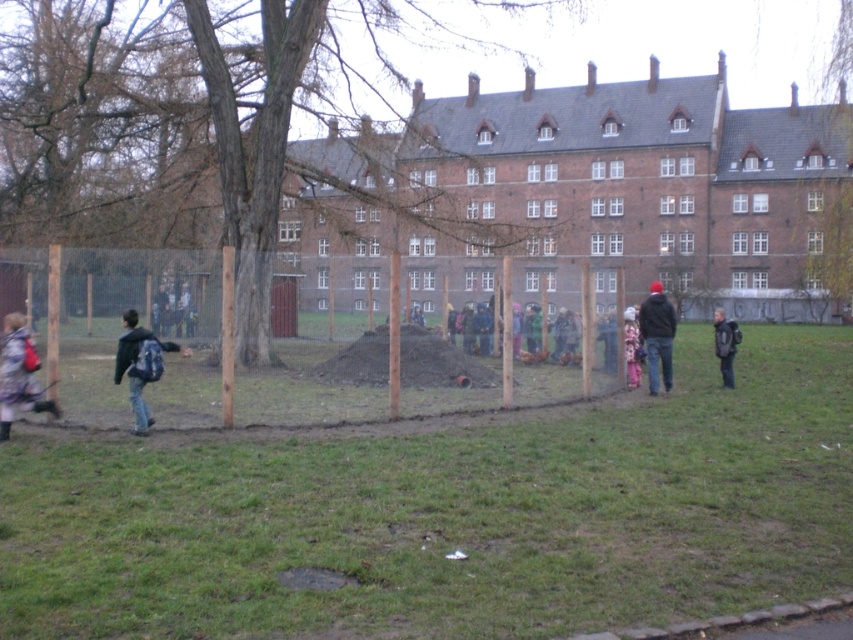
Question: Among these objects, which one is nearest to the camera?

Choices:
 (A) dark gray backpack at right
 (B) matte pink backpack at lower left
 (C) matte black backpack at left
 (D) brown wooden fence at center

Answer: (D)

Question: Can you confirm if matte black backpack at left is smaller than dark gray backpack at right?

Choices:
 (A) yes
 (B) no

Answer: (A)

Question: Which point is closer to the camera taking this photo?

Choices:
 (A) (732, 376)
 (B) (131, 333)
 (C) (20, 372)
 (D) (94, 602)

Answer: (D)

Question: Can you confirm if dark blue jacket at center is positioned above dark gray backpack at right?

Choices:
 (A) no
 (B) yes

Answer: (B)

Question: Can you confirm if brown wooden fence at center is positioned to the right of matte pink backpack at lower left?

Choices:
 (A) no
 (B) yes

Answer: (B)

Question: Which object is farther from the camera taking this photo?

Choices:
 (A) dark gray backpack at right
 (B) matte black backpack at left
 (C) matte pink backpack at lower left

Answer: (A)